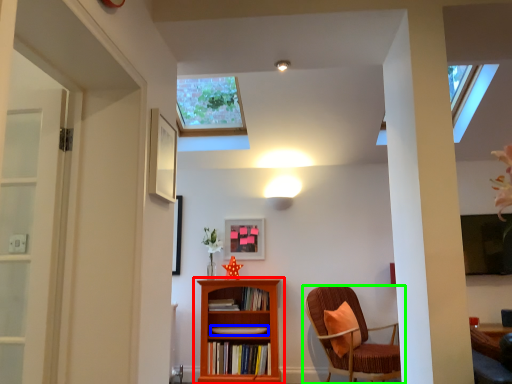
Question: Which object is positioned farthest from bookcase (highlighted by a red box)? Select from book (highlighted by a blue box) and chair (highlighted by a green box).

Choices:
 (A) book
 (B) chair

Answer: (B)